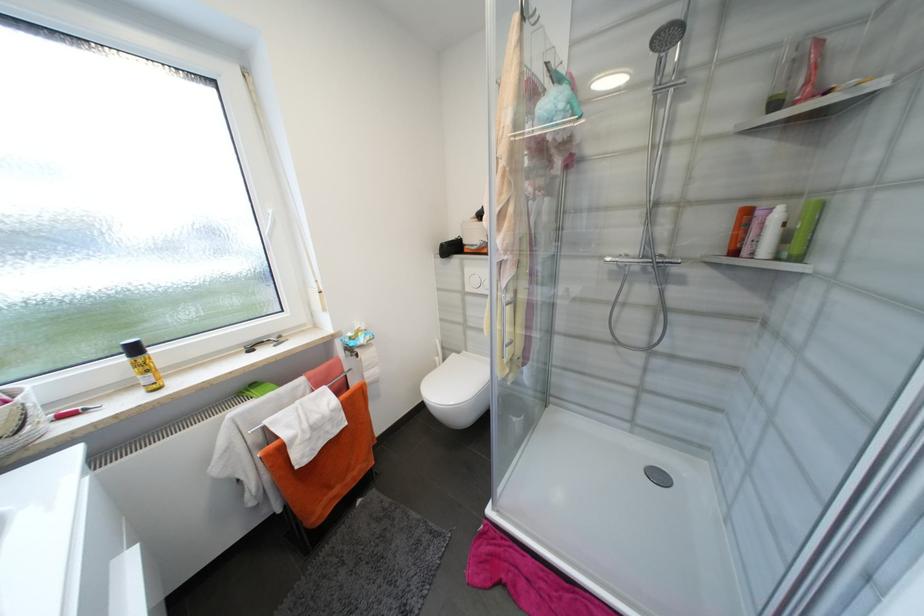
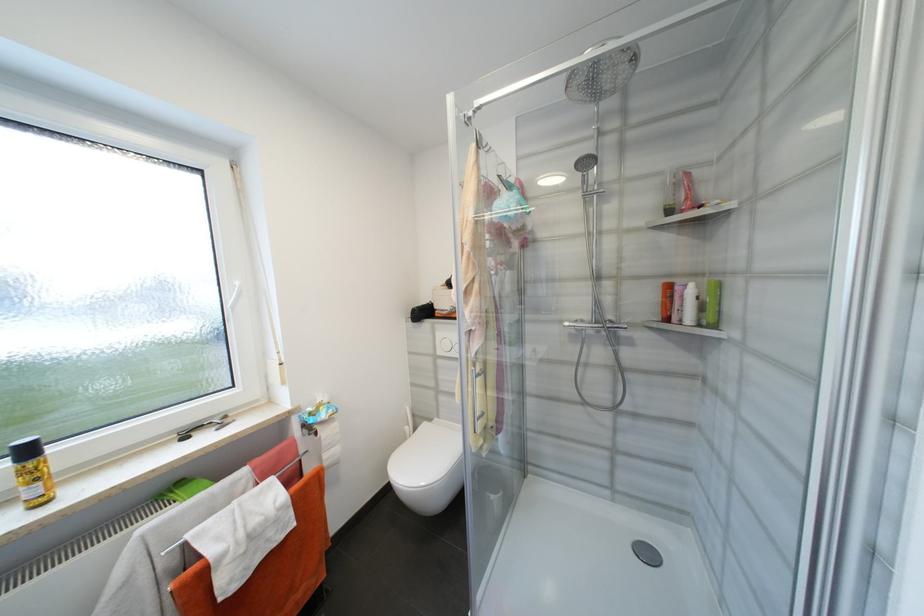
Find the pixel in the second image that matches point (466, 289) in the first image.

(436, 352)